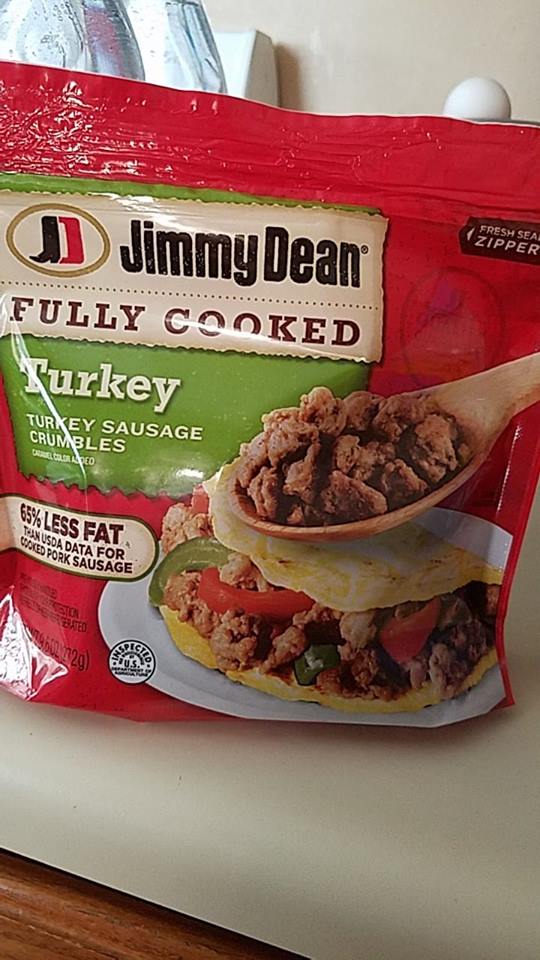
You are a GUI agent. You are given a task and a screenshot of the screen. Output one action in this format:
    pyautogui.click(x=<x>, y=<y>)
    Task: Click on the wooden spoon
    The width and height of the screenshot is (540, 960).
    Given the screenshot: What is the action you would take?
    click(x=328, y=526), click(x=471, y=428)